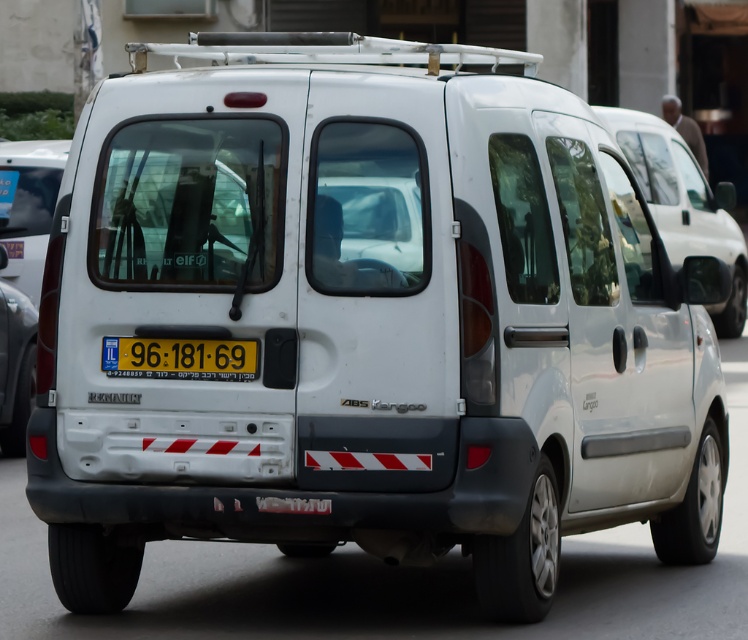
Question: Which of the following is the farthest from the observer?

Choices:
 (A) (690, 176)
 (B) (135, 340)

Answer: (A)

Question: Does white matte van at center have a larger size compared to yellow plastic license plate at center?

Choices:
 (A) no
 (B) yes

Answer: (B)

Question: Can you confirm if white matte van at center is positioned below yellow plastic license plate at center?

Choices:
 (A) yes
 (B) no

Answer: (B)

Question: Which point is closer to the camera taking this photo?

Choices:
 (A) (654, 116)
 (B) (230, 353)

Answer: (B)

Question: Does white matte van at center come in front of yellow plastic license plate at center?

Choices:
 (A) no
 (B) yes

Answer: (A)

Question: Which object appears farthest from the camera in this image?

Choices:
 (A) white matte van at center
 (B) yellow plastic license plate at center

Answer: (A)